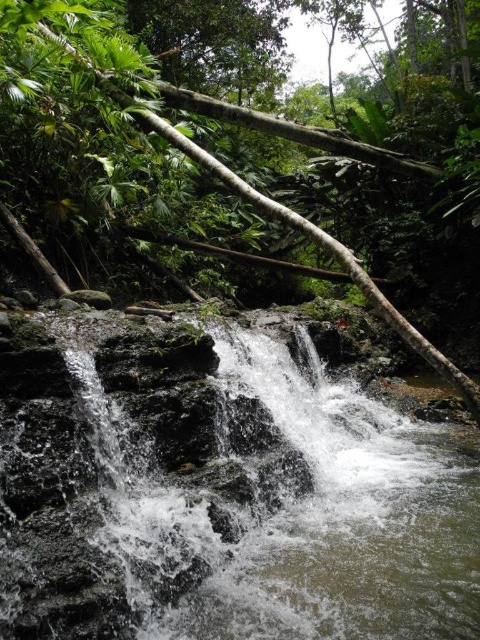
Question: Which point is closer to the camera taking this photo?

Choices:
 (A) (368, 291)
 (B) (243, 419)

Answer: (B)

Question: Does clear water at center have a lesser width compared to green rough log at center?

Choices:
 (A) no
 (B) yes

Answer: (B)

Question: Is clear water at center positioned behind green rough log at center?

Choices:
 (A) yes
 (B) no

Answer: (B)

Question: From the image, what is the correct spatial relationship of clear water at center in relation to green rough log at center?

Choices:
 (A) below
 (B) above

Answer: (A)